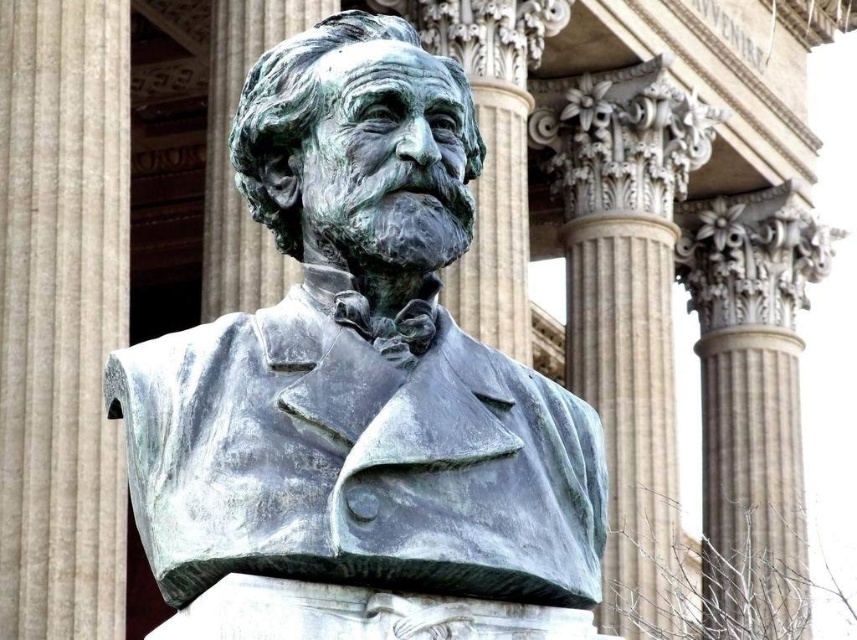
Is point (508, 433) closer to viewer compared to point (16, 358)?

That is True.

Is green patina bust at center behind green patina stone pillar at center?

That is False.

Is point (414, 225) behind point (64, 577)?

No, (414, 225) is closer to viewer.

Where is `green patina bust at center`? green patina bust at center is located at coordinates (358, 362).

Is green patina bust at center to the left of green patina stone bust at center from the viewer's perspective?

Incorrect, green patina bust at center is not on the left side of green patina stone bust at center.

Is point (435, 230) more distant than point (253, 17)?

No, it is in front of (253, 17).

Does point (246, 372) come closer to viewer compared to point (219, 122)?

That is True.

I want to click on green patina bust at center, so click(x=358, y=362).

Can you confirm if green patina bust at center is taller than smooth stone column at center?

No.

Is the position of green patina bust at center more distant than that of smooth stone column at center?

No, it is not.

Who is more forward, (300, 371) or (628, 243)?

Point (300, 371) is more forward.

Locate an element on the screen. This screenshot has width=857, height=640. green patina bust at center is located at coordinates click(x=358, y=362).